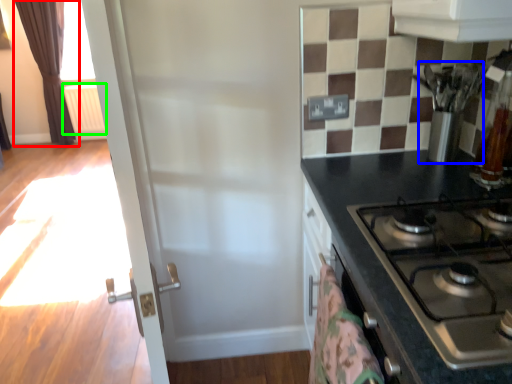
Question: Considering the real-world distances, which object is farthest from curtain (highlighted by a red box)? appliance (highlighted by a blue box) or radiator (highlighted by a green box)?

Choices:
 (A) appliance
 (B) radiator

Answer: (A)